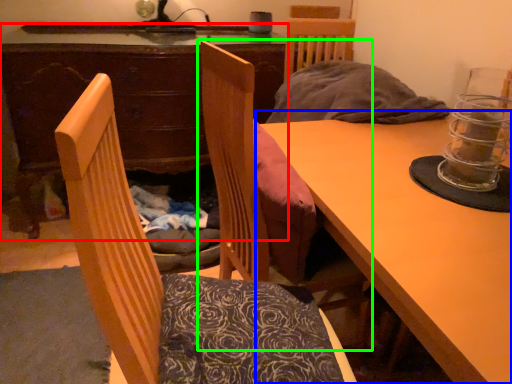
Question: Which object is the closest to the desk (highlighted by a red box)? Choose among these: table (highlighted by a blue box) or chair (highlighted by a green box).

Choices:
 (A) table
 (B) chair

Answer: (B)